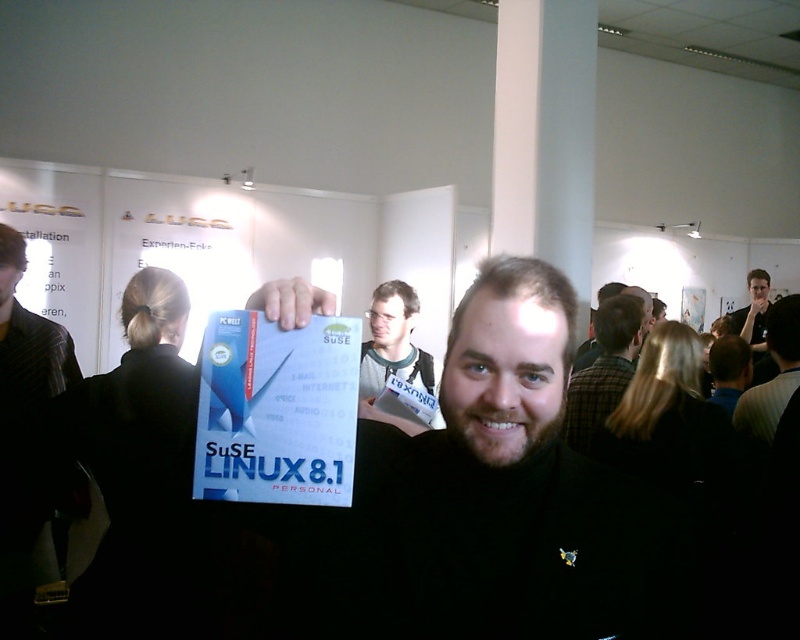
Question: Does plaid shirt at center come in front of dark gray shirt at center?

Choices:
 (A) yes
 (B) no

Answer: (B)

Question: Does plaid shirt at center appear under black shirt at center?

Choices:
 (A) yes
 (B) no

Answer: (A)

Question: Which object appears farthest from the camera in this image?

Choices:
 (A) dark gray shirt at center
 (B) plaid shirt at center

Answer: (B)

Question: Which point is closer to the camera?

Choices:
 (A) plaid shirt at center
 (B) matte black glasses at upper center
 (C) white paper at center
 (D) dark gray shirt at center

Answer: (C)

Question: From the image, what is the correct spatial relationship of matte black glasses at upper center in relation to dark gray shirt at center?

Choices:
 (A) right
 (B) left

Answer: (B)

Question: Among these objects, which one is farthest from the camera?

Choices:
 (A) white paper at center
 (B) dark gray shirt at center
 (C) black matte book at center

Answer: (B)